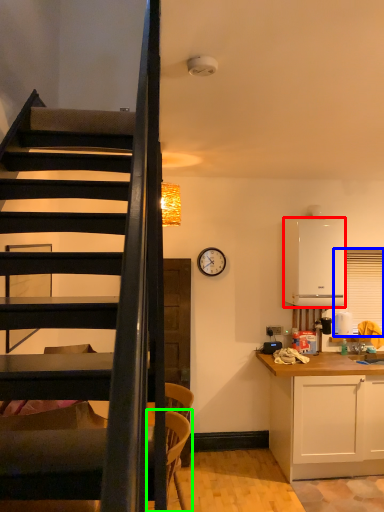
Question: Based on their relative distances, which object is farther from appliance (highlighted by a red box)? Choose from window screen (highlighted by a blue box) and armchair (highlighted by a green box).

Choices:
 (A) window screen
 (B) armchair

Answer: (B)